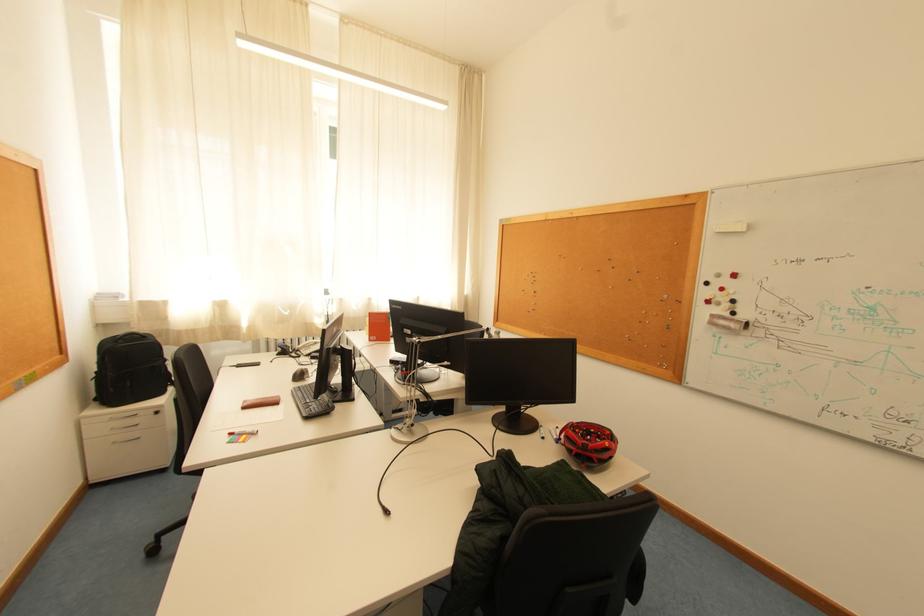
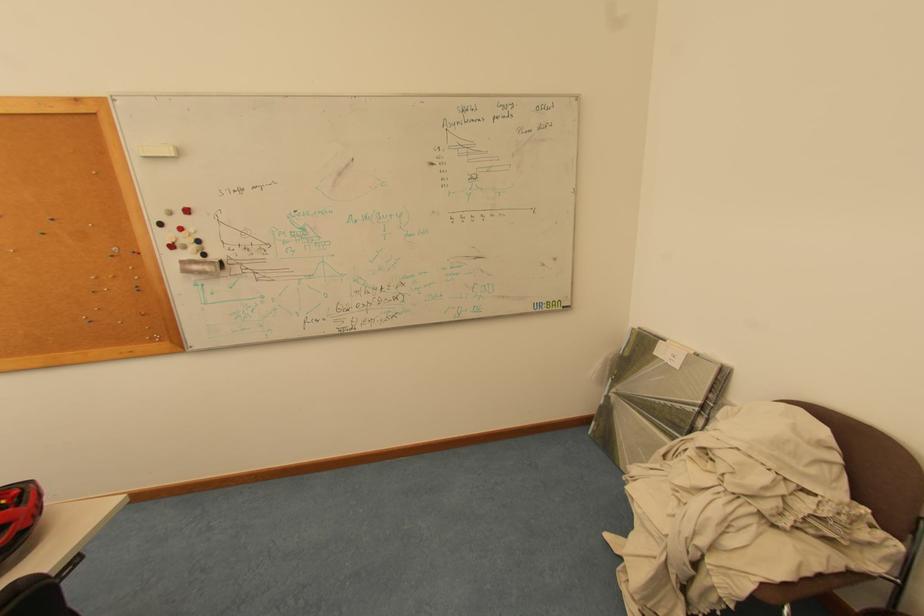
The point at (x=726, y=305) is marked in the first image. Where is the corresponding point in the second image?

(193, 249)